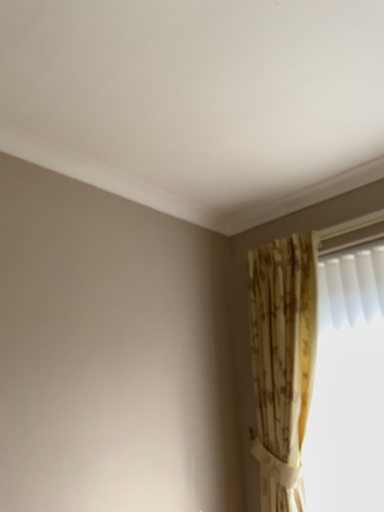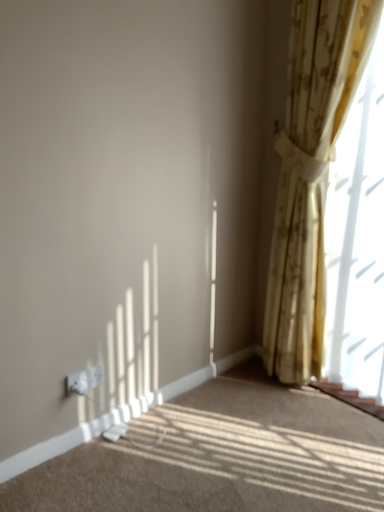
Question: Which way did the camera rotate in the video?

Choices:
 (A) rotated downward
 (B) rotated upward

Answer: (A)